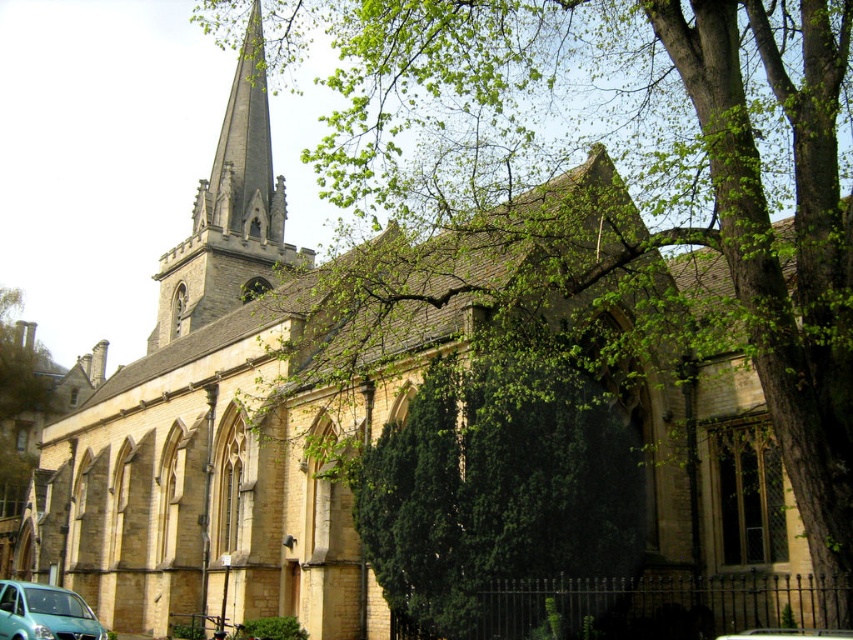
Question: Can you confirm if dark gray stone steeple at upper left is positioned to the right of teal matte van at lower left?

Choices:
 (A) no
 (B) yes

Answer: (B)

Question: Which of the following is the closest to the observer?

Choices:
 (A) (187, 332)
 (B) (264, 170)
 (C) (102, 637)

Answer: (C)

Question: Which point appears closest to the camera in this image?

Choices:
 (A) (0, 595)
 (B) (199, 304)
 (C) (260, 145)

Answer: (A)

Question: Can you confirm if dark gray stone steeple at upper left is smaller than smooth gray stone spire at upper center?

Choices:
 (A) no
 (B) yes

Answer: (A)

Question: Is smooth gray stone spire at upper center to the left of teal matte van at lower left from the viewer's perspective?

Choices:
 (A) yes
 (B) no

Answer: (B)

Question: Which object appears closest to the camera in this image?

Choices:
 (A) smooth gray stone spire at upper center
 (B) teal matte van at lower left

Answer: (B)